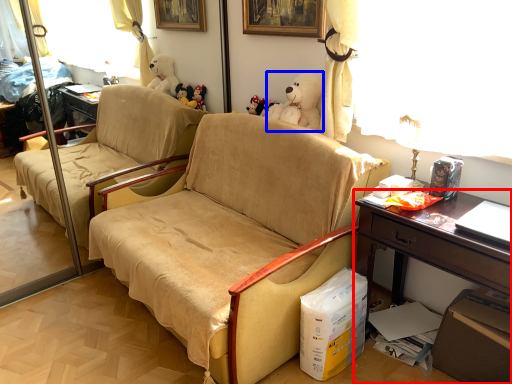
Question: Which of the following is the farthest to the observer, desk (highlighted by a red box) or toy (highlighted by a blue box)?

Choices:
 (A) desk
 (B) toy

Answer: (B)